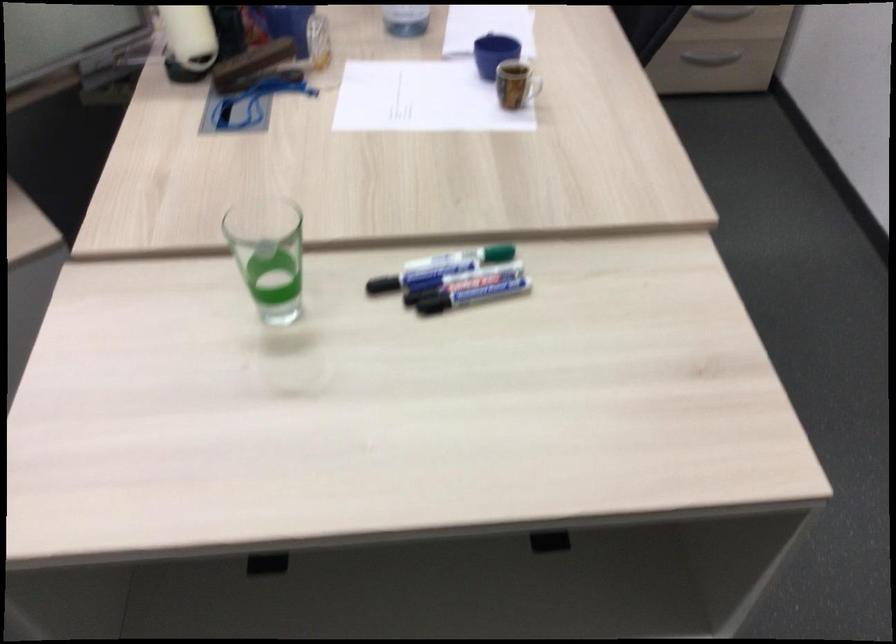
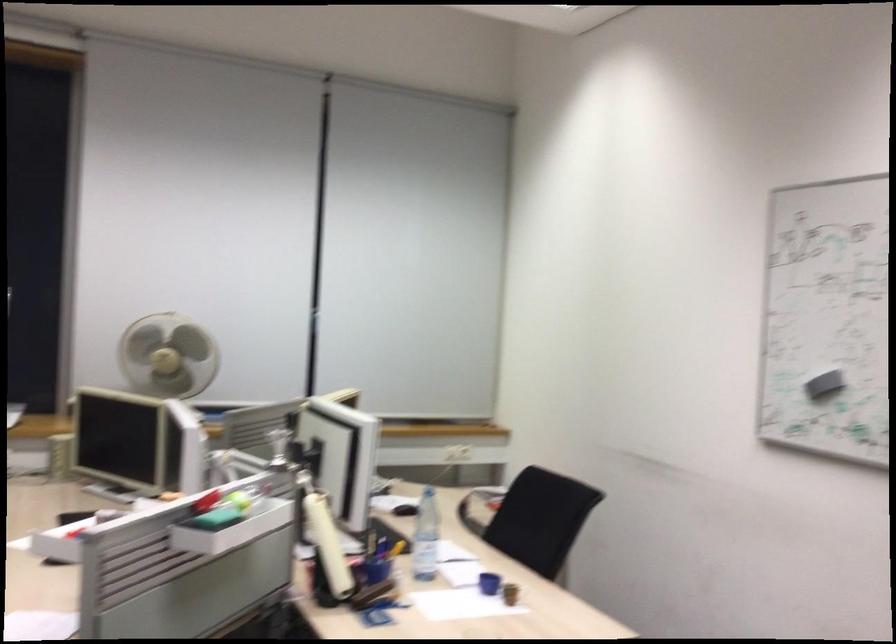
Question: I am providing you with two images of the same scene from different viewpoints. After the viewpoint changes to image2, which objects are now occluded?

Choices:
 (A) black drawer handle
 (B) blue cup
 (C) large yellow box
 (D) plastic water bottle

Answer: (A)